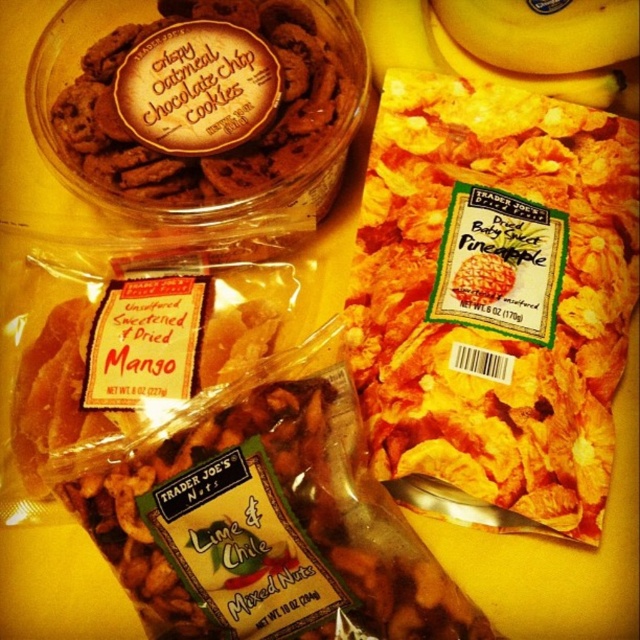
What is located at point (x=218, y=148)?

The crispy oatmeal chocolate chip cookies at upper left are located at point (x=218, y=148).

You are planning to pack snacks for a picnic and have both the yellow crunchy pineapple at upper right and the crispy oatmeal chocolate chip cookies at upper left in front of you. Which snack takes up more space in your picnic basket?

The yellow crunchy pineapple at upper right takes up more space in your picnic basket because it has a larger size compared to the crispy oatmeal chocolate chip cookies at upper left.

You are organizing snacks on a shelf and need to know which snack is taller. You have the yellow crunchy pineapple at upper right and the crispy oatmeal chocolate chip cookies at upper left. Which one is taller?

The yellow crunchy pineapple at upper right is much taller than the crispy oatmeal chocolate chip cookies at upper left according to the description.